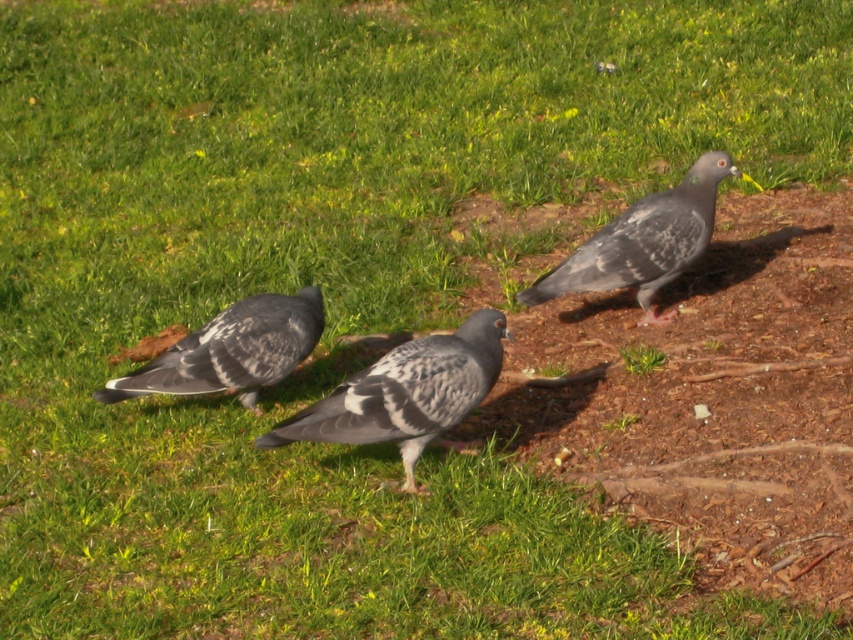
Can you confirm if speckled feather pigeon at center is shorter than speckled gray pigeon at center?

Indeed, speckled feather pigeon at center has a lesser height compared to speckled gray pigeon at center.

Can you confirm if speckled feather pigeon at center is thinner than speckled gray pigeon at center?

Correct, speckled feather pigeon at center's width is less than speckled gray pigeon at center's.

You are a GUI agent. You are given a task and a screenshot of the screen. Output one action in this format:
    pyautogui.click(x=<x>, y=<y>)
    Task: Click on the speckled feather pigeon at center
    
    Given the screenshot: What is the action you would take?
    pyautogui.click(x=405, y=394)

Consider the image. Who is more distant from viewer, (704,161) or (291,314)?

Point (704,161)

Is speckled gray pigeon at center positioned at the back of gray speckled pigeon at lower left?

Yes, speckled gray pigeon at center is further from the viewer.

Image resolution: width=853 pixels, height=640 pixels. Describe the element at coordinates (643, 241) in the screenshot. I see `speckled gray pigeon at center` at that location.

Identify the location of speckled gray pigeon at center. The image size is (853, 640). (643, 241).

Can you confirm if speckled feather pigeon at center is taller than gray speckled pigeon at lower left?

Correct, speckled feather pigeon at center is much taller as gray speckled pigeon at lower left.

Who is more forward, (384,374) or (288,356)?

Point (384,374) is more forward.

Which is in front, point (376, 397) or point (253, 371)?

Point (376, 397)

Identify the location of speckled feather pigeon at center. (405, 394).